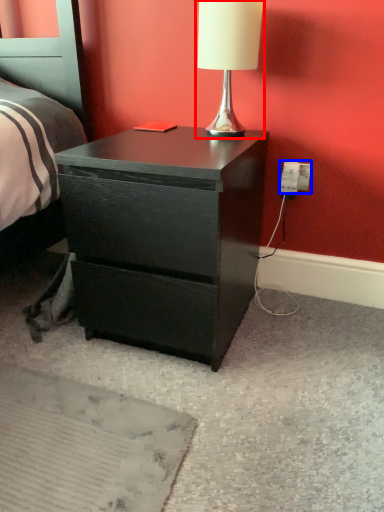
Question: Which object appears closest to the camera in this image, table lamp (highlighted by a red box) or electric outlet (highlighted by a blue box)?

Choices:
 (A) table lamp
 (B) electric outlet

Answer: (A)